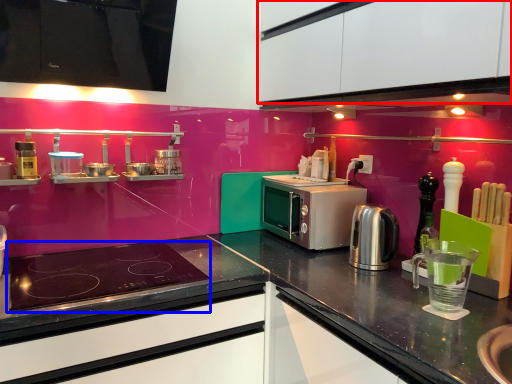
Question: Which object appears closest to the camera in this image, cabinetry (highlighted by a red box) or gas stove (highlighted by a blue box)?

Choices:
 (A) cabinetry
 (B) gas stove

Answer: (A)